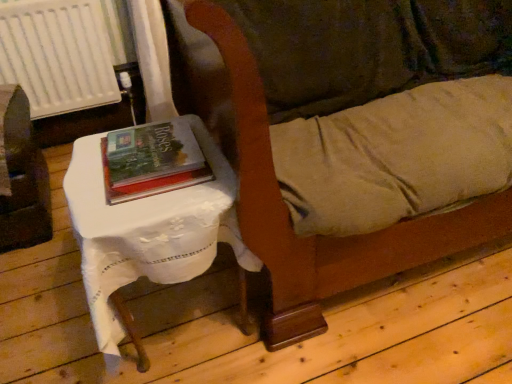
Question: Is the position of hardcover book at center less distant than that of brushed metal table at left?

Choices:
 (A) yes
 (B) no

Answer: (A)

Question: Considering the relative sizes of hardcover book at center and brushed metal table at left in the image provided, is hardcover book at center wider than brushed metal table at left?

Choices:
 (A) yes
 (B) no

Answer: (B)

Question: Considering the relative sizes of hardcover book at center and brushed metal table at left in the image provided, is hardcover book at center taller than brushed metal table at left?

Choices:
 (A) yes
 (B) no

Answer: (B)

Question: From a real-world perspective, is hardcover book at center on top of brushed metal table at left?

Choices:
 (A) yes
 (B) no

Answer: (A)

Question: Can you confirm if hardcover book at center is smaller than brushed metal table at left?

Choices:
 (A) no
 (B) yes

Answer: (B)

Question: Can you confirm if hardcover book at center is positioned to the right of brushed metal table at left?

Choices:
 (A) yes
 (B) no

Answer: (A)

Question: From the image's perspective, would you say hardcover book at center is shown under velvet-like brown couch at center?

Choices:
 (A) yes
 (B) no

Answer: (A)

Question: Is hardcover book at center at the left side of velvet-like brown couch at center?

Choices:
 (A) no
 (B) yes

Answer: (B)

Question: Is hardcover book at center facing towards velvet-like brown couch at center?

Choices:
 (A) yes
 (B) no

Answer: (B)

Question: Is hardcover book at center outside of velvet-like brown couch at center?

Choices:
 (A) yes
 (B) no

Answer: (B)

Question: Are hardcover book at center and velvet-like brown couch at center located far from each other?

Choices:
 (A) no
 (B) yes

Answer: (A)

Question: Considering the relative positions of hardcover book at center and velvet-like brown couch at center in the image provided, is hardcover book at center behind velvet-like brown couch at center?

Choices:
 (A) no
 (B) yes

Answer: (B)

Question: Is white plastic radiator at upper left facing towards hardcover book at center?

Choices:
 (A) yes
 (B) no

Answer: (A)